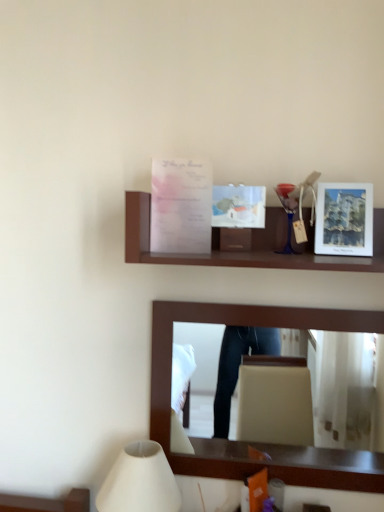
Question: From the image's perspective, is translucent paper postcard at upper center under matte white picture frame at right?

Choices:
 (A) yes
 (B) no

Answer: (B)

Question: From a real-world perspective, is translucent paper postcard at upper center physically below matte white picture frame at right?

Choices:
 (A) no
 (B) yes

Answer: (A)

Question: Is translucent paper postcard at upper center thinner than matte white picture frame at right?

Choices:
 (A) yes
 (B) no

Answer: (A)

Question: Is translucent paper postcard at upper center not close to matte white picture frame at right?

Choices:
 (A) yes
 (B) no

Answer: (B)

Question: Is the position of translucent paper postcard at upper center more distant than that of matte white picture frame at right?

Choices:
 (A) no
 (B) yes

Answer: (A)

Question: Based on their positions, is wooden shelf at center located to the left or right of brown wooden mirror at upper center?

Choices:
 (A) right
 (B) left

Answer: (B)

Question: From the image's perspective, is wooden shelf at center located above or below brown wooden mirror at upper center?

Choices:
 (A) below
 (B) above

Answer: (B)

Question: Considering the positions of wooden shelf at center and brown wooden mirror at upper center in the image, is wooden shelf at center bigger or smaller than brown wooden mirror at upper center?

Choices:
 (A) big
 (B) small

Answer: (A)

Question: Is wooden shelf at center spatially inside brown wooden mirror at upper center, or outside of it?

Choices:
 (A) outside
 (B) inside

Answer: (A)

Question: Based on their positions, is brown wooden mirror at upper center located to the left or right of wooden shelf at center?

Choices:
 (A) left
 (B) right

Answer: (B)

Question: From a real-world perspective, is brown wooden mirror at upper center above or below wooden shelf at center?

Choices:
 (A) above
 (B) below

Answer: (B)

Question: From the image's perspective, relative to wooden shelf at center, is brown wooden mirror at upper center above or below?

Choices:
 (A) below
 (B) above

Answer: (A)

Question: Would you say brown wooden mirror at upper center is inside or outside wooden shelf at center?

Choices:
 (A) inside
 (B) outside

Answer: (B)

Question: Visually, is translucent paper postcard at upper center positioned to the left or to the right of brown wooden mirror at upper center?

Choices:
 (A) right
 (B) left

Answer: (B)

Question: From a real-world perspective, relative to brown wooden mirror at upper center, is translucent paper postcard at upper center vertically above or below?

Choices:
 (A) above
 (B) below

Answer: (A)